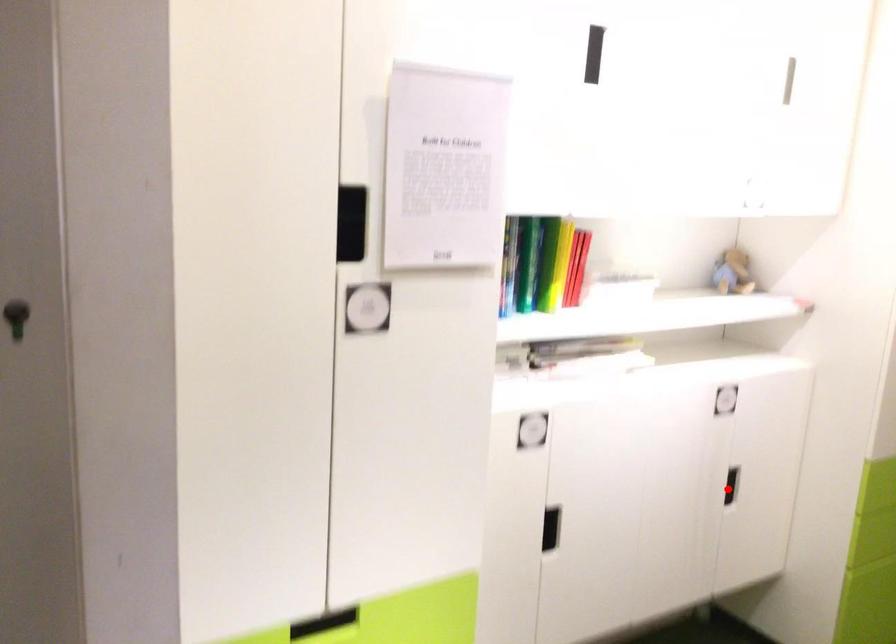
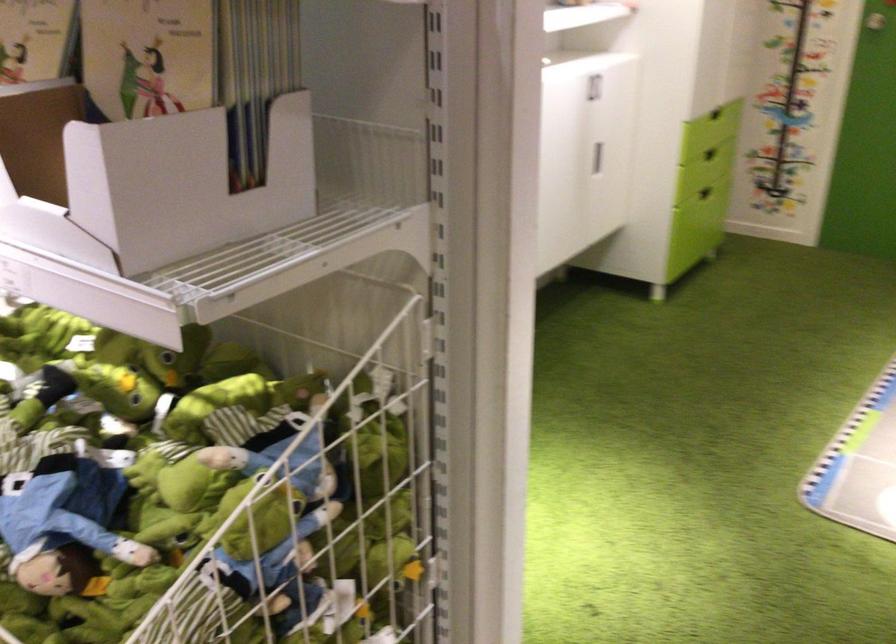
Question: I am providing you with two images of the same scene from different viewpoints. In image1, a red point is highlighted. Considering the same 3D point in image2, which of the following is correct?

Choices:
 (A) It is closer
 (B) It is farther

Answer: (B)